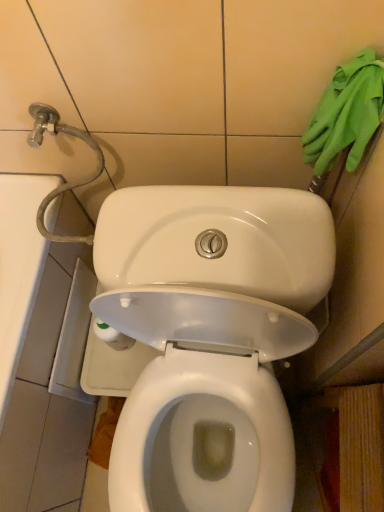
Question: From their relative heights in the image, would you say white glossy toilet at center is taller or shorter than green rubber gloves at upper right?

Choices:
 (A) tall
 (B) short

Answer: (A)

Question: In the image, is white glossy toilet at center positioned in front of or behind green rubber gloves at upper right?

Choices:
 (A) behind
 (B) front

Answer: (B)

Question: Considering the positions of point (266, 322) and point (340, 83), is point (266, 322) closer or farther from the camera than point (340, 83)?

Choices:
 (A) farther
 (B) closer

Answer: (A)

Question: From a real-world perspective, is green rubber gloves at upper right positioned above or below white glossy toilet at center?

Choices:
 (A) above
 (B) below

Answer: (A)

Question: From the image's perspective, is green rubber gloves at upper right above or below white glossy toilet at center?

Choices:
 (A) below
 (B) above

Answer: (B)

Question: In terms of width, does green rubber gloves at upper right look wider or thinner when compared to white glossy toilet at center?

Choices:
 (A) thin
 (B) wide

Answer: (A)

Question: Considering the positions of green rubber gloves at upper right and white glossy toilet at center in the image, is green rubber gloves at upper right bigger or smaller than white glossy toilet at center?

Choices:
 (A) small
 (B) big

Answer: (A)